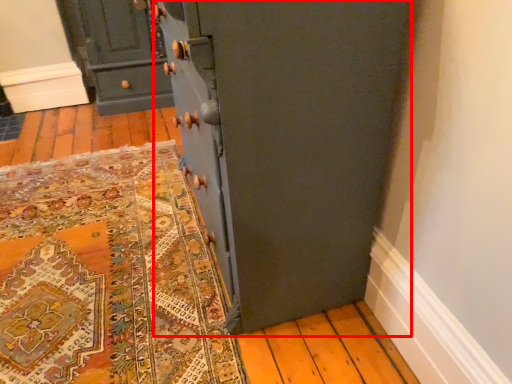
Question: From the image, what is the correct spatial relationship of cupboard (annotated by the red box) in relation to chest of drawers?

Choices:
 (A) right
 (B) left

Answer: (A)